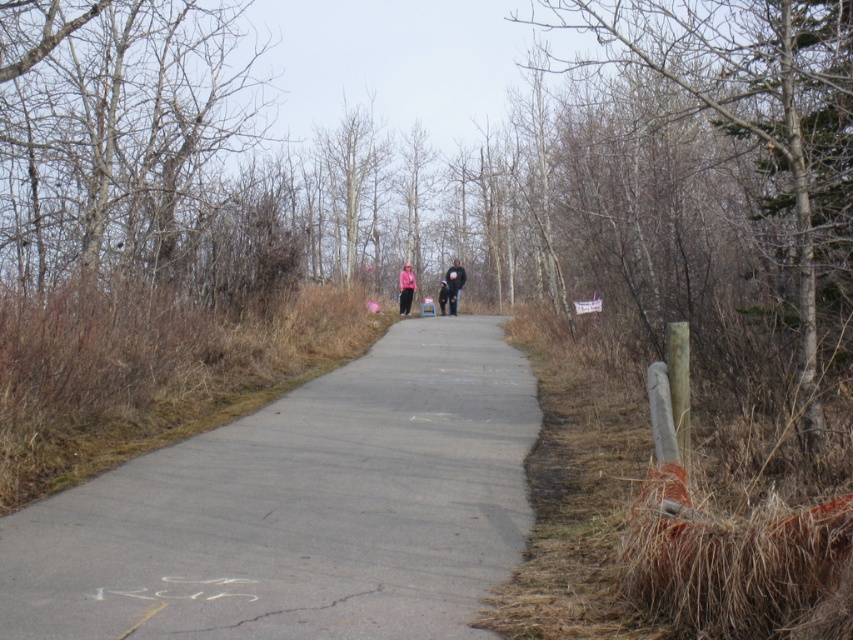
Question: Which is farther from the gray concrete pavement at center?

Choices:
 (A) smooth bark tree at right
 (B) black matte jacket at center
 (C) pink fabric at center

Answer: (B)

Question: Is gray concrete pavement at center above black matte jacket at center?

Choices:
 (A) yes
 (B) no

Answer: (B)

Question: Where is smooth bark tree at right located in relation to black matte jacket at center in the image?

Choices:
 (A) above
 (B) below

Answer: (A)

Question: Which is farther from the smooth bark tree at right?

Choices:
 (A) pink fabric at center
 (B) black matte jacket at center

Answer: (A)

Question: Among these objects, which one is farthest from the camera?

Choices:
 (A) smooth bark tree at right
 (B) pink fabric at center

Answer: (B)

Question: Does gray concrete pavement at center have a larger size compared to smooth bark tree at right?

Choices:
 (A) yes
 (B) no

Answer: (B)